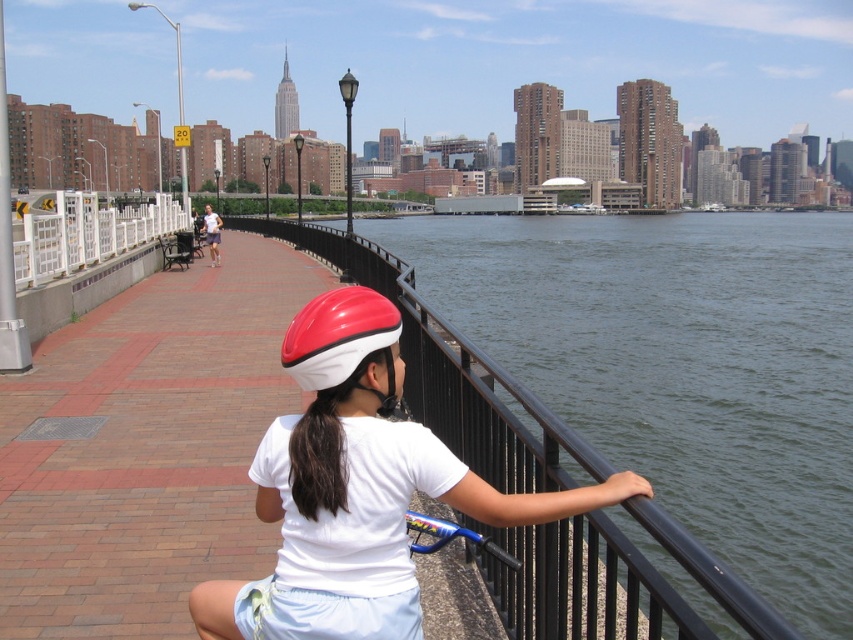
Does shiny plastic helmet at center have a larger size compared to shiny red and white helmet at center?

Yes, shiny plastic helmet at center is bigger than shiny red and white helmet at center.

Which is behind, point (207, 592) or point (366, 308)?

Positioned behind is point (207, 592).

Where is `shiny plastic helmet at center`? shiny plastic helmet at center is located at coordinates (370, 460).

Can you confirm if dark green water at center is shorter than shiny plastic helmet at center?

Incorrect, dark green water at center's height does not fall short of shiny plastic helmet at center's.

Is dark green water at center smaller than shiny plastic helmet at center?

Actually, dark green water at center might be larger than shiny plastic helmet at center.

Locate an element on the screen. dark green water at center is located at coordinates (682, 365).

The image size is (853, 640). What are the coordinates of `dark green water at center` in the screenshot? It's located at (682, 365).

At what (x,y) coordinates should I click in order to perform the action: click on dark green water at center. Please return your answer as a coordinate pair (x, y). This screenshot has width=853, height=640. Looking at the image, I should click on (682, 365).

Does dark green water at center have a smaller size compared to shiny red and white helmet at center?

Incorrect, dark green water at center is not smaller in size than shiny red and white helmet at center.

Does point (508, 332) lie behind point (283, 348)?

Yes, point (508, 332) is behind point (283, 348).

Identify the location of dark green water at center. (682, 365).